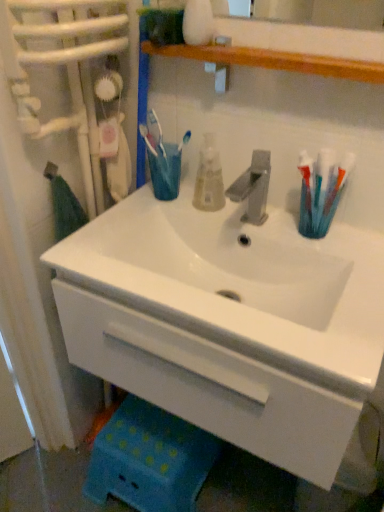
Image resolution: width=384 pixels, height=512 pixels. I want to click on free space to the left of translucent plastic mouthwash at center, so click(135, 212).